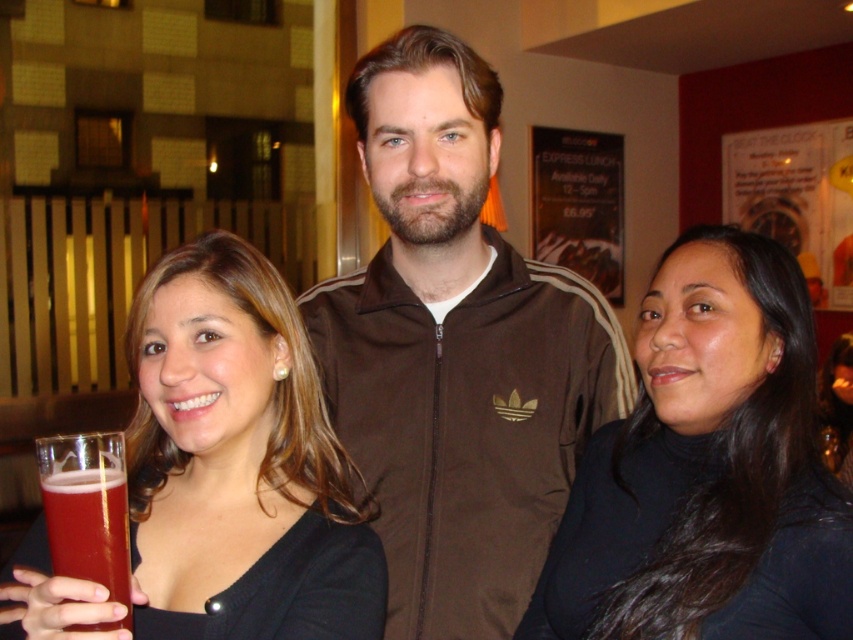
How distant is brown zip-up jacket at center from matte black hair at center?

brown zip-up jacket at center and matte black hair at center are 6.52 feet apart from each other.

Is brown zip-up jacket at center taller than matte black hair at center?

Correct, brown zip-up jacket at center is much taller as matte black hair at center.

Between point (398, 394) and point (830, 348), which one is positioned in front?

Point (398, 394) is more forward.

I want to click on brown zip-up jacket at center, so click(456, 353).

Is matte black dress at center closer to camera compared to translucent glass beer at lower left?

Yes, matte black dress at center is in front of translucent glass beer at lower left.

Who is more distant from viewer, [146,502] or [119,477]?

The point [146,502] is more distant.

In order to click on matte black dress at center in this screenshot , I will do `click(239, 464)`.

Is matte black dress at center positioned behind matte black hair at center?

No, it is in front of matte black hair at center.

Which is below, matte black dress at center or matte black hair at center?

matte black hair at center is lower down.

The width and height of the screenshot is (853, 640). I want to click on matte black dress at center, so click(239, 464).